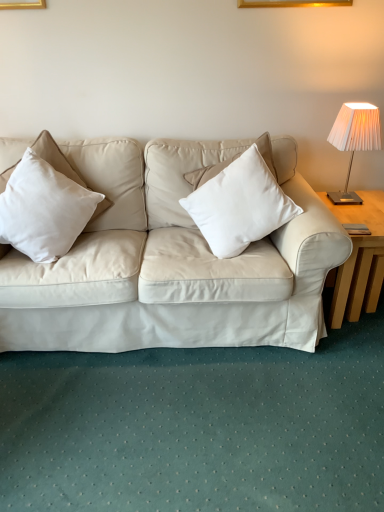
Question: Is white cotton pillow at left, marked as the 2th pillow in a right-to-left arrangement, oriented away from white pleated fabric lampshade at upper right?

Choices:
 (A) no
 (B) yes

Answer: (A)

Question: From the image's perspective, would you say white cotton pillow at left, marked as the 1th pillow in a left-to-right arrangement, is shown under white pleated fabric lampshade at upper right?

Choices:
 (A) yes
 (B) no

Answer: (A)

Question: Is white cotton pillow at left, marked as the 1th pillow in a left-to-right arrangement, outside white pleated fabric lampshade at upper right?

Choices:
 (A) yes
 (B) no

Answer: (A)

Question: Can you confirm if white cotton pillow at left, marked as the 2th pillow in a right-to-left arrangement, is taller than white pleated fabric lampshade at upper right?

Choices:
 (A) yes
 (B) no

Answer: (B)

Question: Is white cotton pillow at left, marked as the 2th pillow in a right-to-left arrangement, not near white pleated fabric lampshade at upper right?

Choices:
 (A) yes
 (B) no

Answer: (A)

Question: From a real-world perspective, relative to white pleated fabric lampshade at upper right, is white matte pillow at center, which is the first pillow from right to left, vertically above or below?

Choices:
 (A) below
 (B) above

Answer: (A)

Question: Based on their positions, is white matte pillow at center, which is the first pillow from right to left, located to the left or right of white pleated fabric lampshade at upper right?

Choices:
 (A) left
 (B) right

Answer: (A)

Question: Is white matte pillow at center, acting as the second pillow starting from the left, wider or thinner than white pleated fabric lampshade at upper right?

Choices:
 (A) wide
 (B) thin

Answer: (A)

Question: Relative to white pleated fabric lampshade at upper right, is white matte pillow at center, acting as the second pillow starting from the left, in front or behind?

Choices:
 (A) front
 (B) behind

Answer: (A)

Question: Based on their sizes in the image, would you say white cotton pillow at left, marked as the 1th pillow in a left-to-right arrangement, is bigger or smaller than white pleated fabric lampshade at upper right?

Choices:
 (A) small
 (B) big

Answer: (B)

Question: From the image's perspective, is white cotton pillow at left, marked as the 1th pillow in a left-to-right arrangement, positioned above or below white pleated fabric lampshade at upper right?

Choices:
 (A) above
 (B) below

Answer: (B)

Question: From their relative heights in the image, would you say white cotton pillow at left, marked as the 1th pillow in a left-to-right arrangement, is taller or shorter than white pleated fabric lampshade at upper right?

Choices:
 (A) tall
 (B) short

Answer: (B)

Question: In terms of width, does white cotton pillow at left, marked as the 2th pillow in a right-to-left arrangement, look wider or thinner when compared to white pleated fabric lampshade at upper right?

Choices:
 (A) wide
 (B) thin

Answer: (A)

Question: Which is correct: white matte pillow at center, acting as the second pillow starting from the left, is inside light wood table at right, or outside of it?

Choices:
 (A) inside
 (B) outside

Answer: (B)

Question: Looking at their shapes, would you say white matte pillow at center, which is the first pillow from right to left, is wider or thinner than light wood table at right?

Choices:
 (A) thin
 (B) wide

Answer: (A)